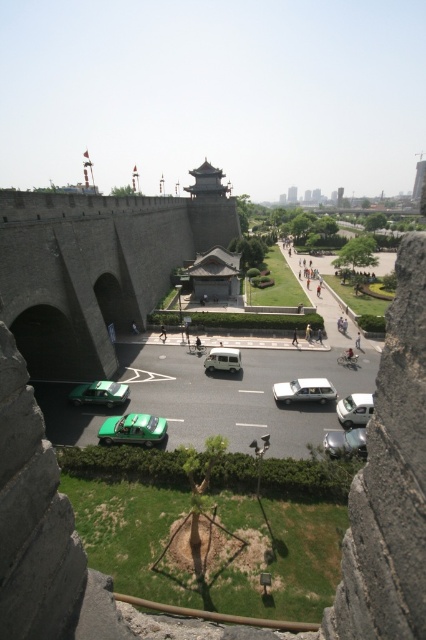
Question: Is stone wall at left bigger than white glossy car at center?

Choices:
 (A) yes
 (B) no

Answer: (A)

Question: Does green matte car at center come behind metallic silver car at center?

Choices:
 (A) no
 (B) yes

Answer: (B)

Question: Which is farther from the metallic silver car at center?

Choices:
 (A) stone wall at left
 (B) silver metallic sedan at center
 (C) green matte car at center
 (D) white matte van at center

Answer: (A)

Question: Which object is closer to the camera taking this photo?

Choices:
 (A) green matte car at lower center
 (B) silver metallic sedan at center
 (C) white glossy car at center

Answer: (A)

Question: Where is silver metallic sedan at center located in relation to metallic silver car at center in the image?

Choices:
 (A) right
 (B) left

Answer: (B)

Question: Which is nearer to the green matte car at lower center?

Choices:
 (A) green matte car at center
 (B) white matte van at center

Answer: (A)